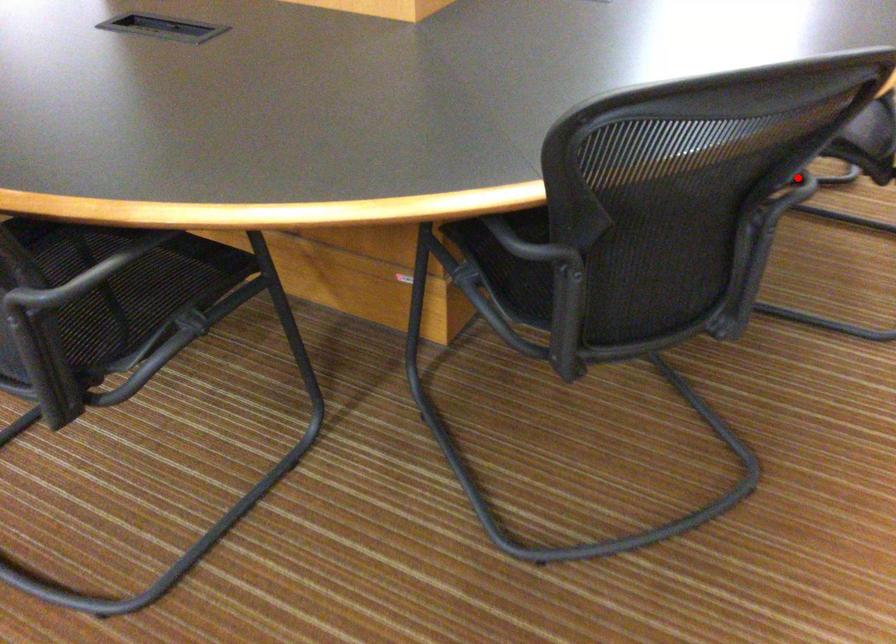
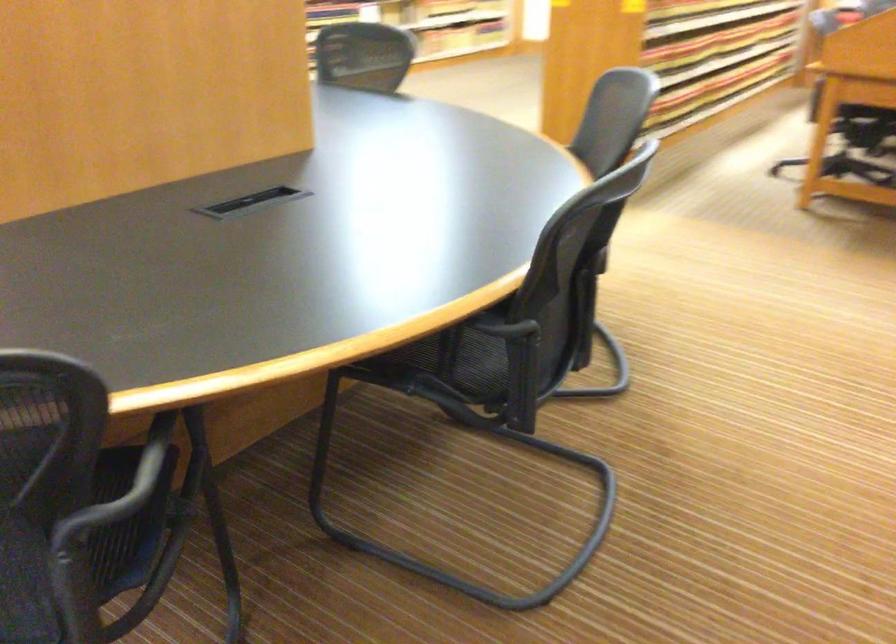
Question: A red point is marked in image1. In image2, is the corresponding 3D point closer to the camera or farther? Reply with the corresponding letter.

Choices:
 (A) The corresponding 3D point is closer.
 (B) The corresponding 3D point is farther.

Answer: (A)